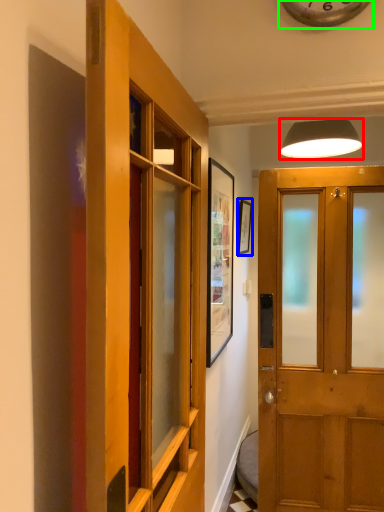
Question: Based on their relative distances, which object is farther from lamp (highlighted by a red box)? Choose from picture frame (highlighted by a blue box) and clock (highlighted by a green box).

Choices:
 (A) picture frame
 (B) clock

Answer: (B)